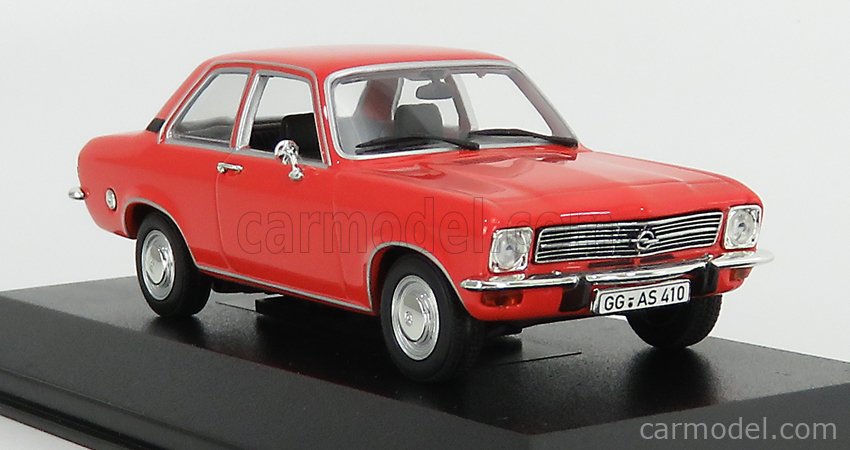
At what (x,y) coordinates should I click in order to perform the action: click on seats. Please return your answer as a coordinate pair (x, y). This screenshot has width=850, height=450. Looking at the image, I should click on (426, 117), (303, 125), (264, 123).